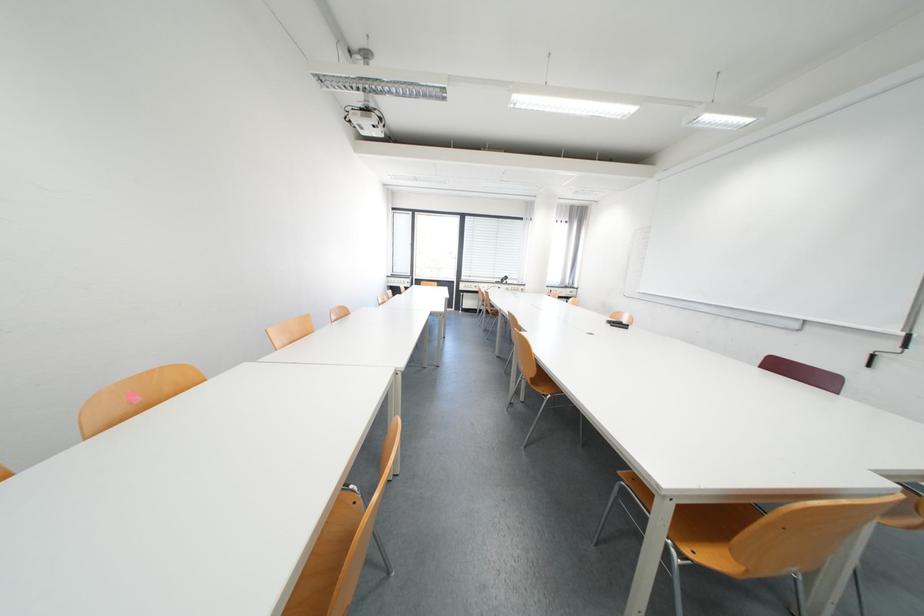
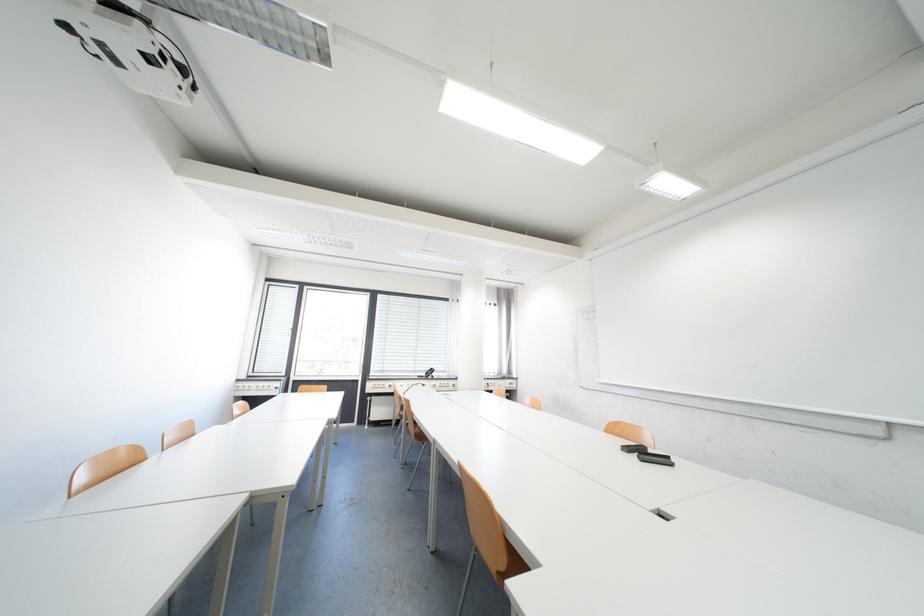
In the second image, find the point that corresponds to point (371, 129) in the first image.

(128, 63)